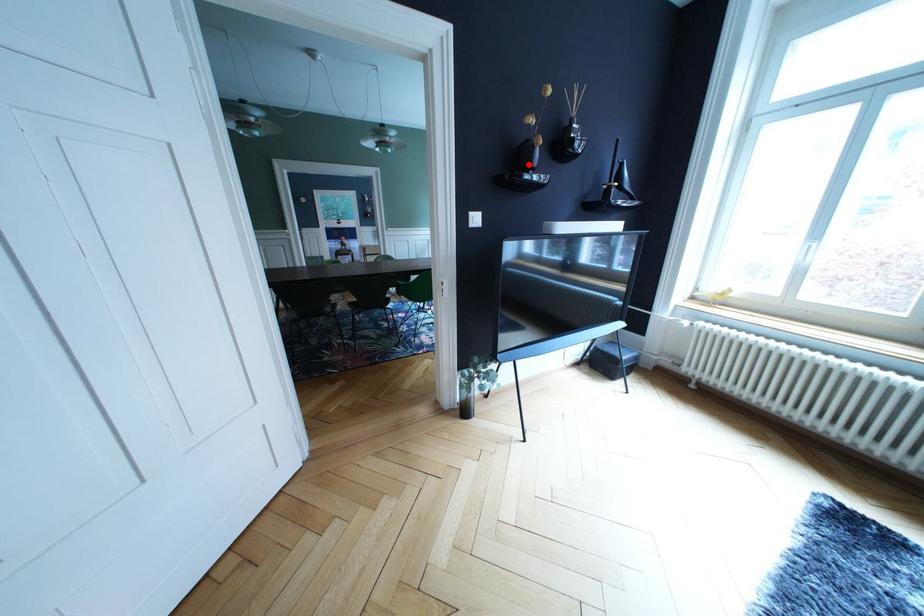
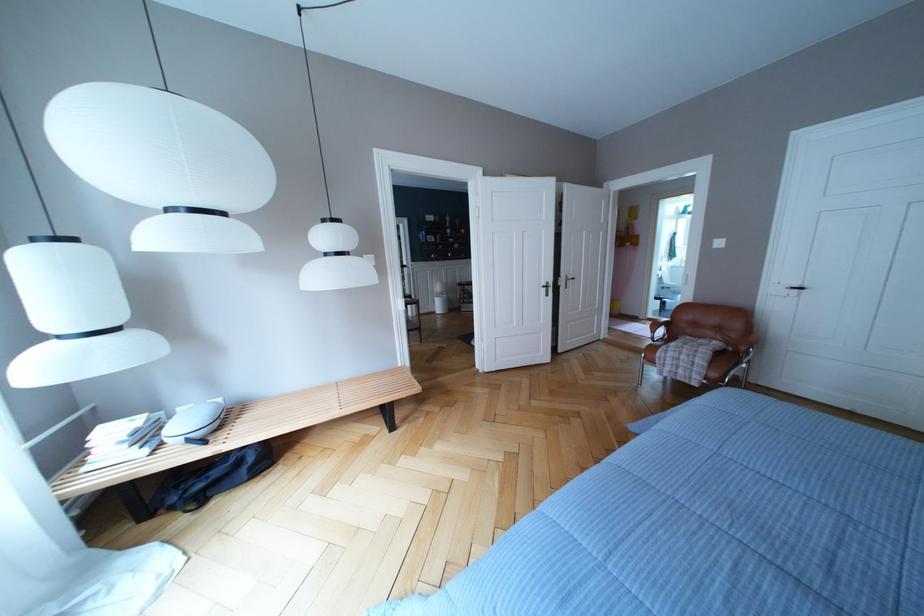
Question: I am providing you with two images of the same scene from different viewpoints. A red point is marked on the first image. Can you still see the location of the red point in image 2?

Choices:
 (A) Yes
 (B) No

Answer: (B)